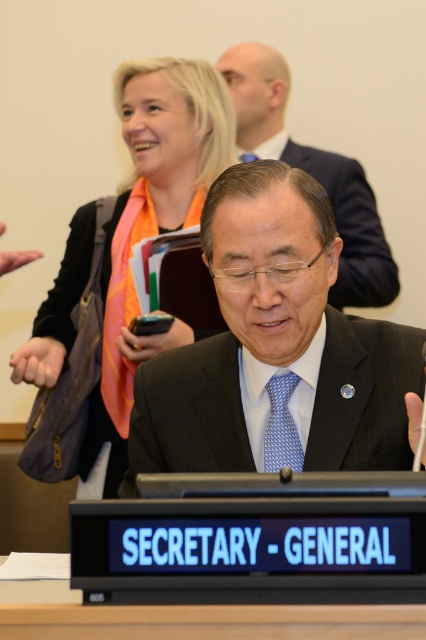
Question: Estimate the real-world distances between objects in this image. Which object is farther from the black suit at center?

Choices:
 (A) orange scarf at upper left
 (B) wooden table at center
 (C) black matte suit at center

Answer: (B)

Question: Is the position of black matte suit at center less distant than that of wooden table at center?

Choices:
 (A) yes
 (B) no

Answer: (B)

Question: Is wooden table at center positioned at the back of black suit at center?

Choices:
 (A) yes
 (B) no

Answer: (B)

Question: Does black matte suit at center have a smaller size compared to black suit at center?

Choices:
 (A) yes
 (B) no

Answer: (A)

Question: Which point is closer to the camera?

Choices:
 (A) (150, 625)
 (B) (367, 294)

Answer: (A)

Question: Which object is farther from the camera taking this photo?

Choices:
 (A) black suit at center
 (B) wooden table at center

Answer: (A)